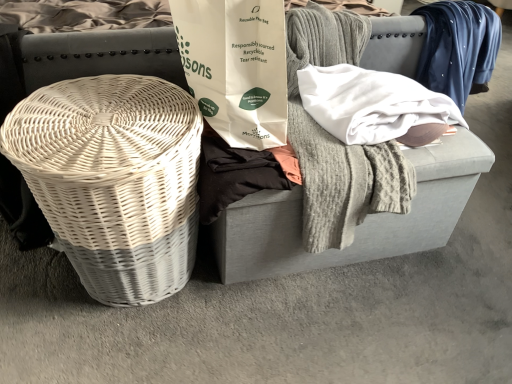
What do you see at coordinates (239, 173) in the screenshot? I see `black cotton shirt at center` at bounding box center [239, 173].

The width and height of the screenshot is (512, 384). What do you see at coordinates (357, 226) in the screenshot? I see `gray fabric footrest at center` at bounding box center [357, 226].

Identify the location of white wicker basket at left. (359, 227).

This screenshot has height=384, width=512. What do you see at coordinates (236, 67) in the screenshot?
I see `white paper bag at center` at bounding box center [236, 67].

Where is `black cotton shirt at center`? black cotton shirt at center is located at coordinates (239, 173).

From a real-world perspective, is white paper bag at center physically located above or below white wicker basket at left?

white paper bag at center is situated higher than white wicker basket at left in the real world.

From the image's perspective, which is above, white paper bag at center or white wicker basket at left?

white wicker basket at left.

The image size is (512, 384). I want to click on furniture that appears on the left of white paper bag at center, so click(x=359, y=227).

Considering the sizes of objects white paper bag at center and white wicker basket at left in the image provided, who is bigger, white paper bag at center or white wicker basket at left?

Bigger between the two is white wicker basket at left.

Is gray fabric footrest at center next to white paper bag at center and touching it?

There is a gap between gray fabric footrest at center and white paper bag at center.

Is white paper bag at center at the back of gray fabric footrest at center?

gray fabric footrest at center does not have its back to white paper bag at center.

Is point (252, 270) positioned before point (210, 7)?

No, it is behind (210, 7).

Which is in front, gray fabric footrest at center or white paper bag at center?

Positioned in front is white paper bag at center.

Considering the relative positions of gray fabric footrest at center and black cotton shirt at center in the image provided, is gray fabric footrest at center to the left of black cotton shirt at center from the viewer's perspective?

In fact, gray fabric footrest at center is to the right of black cotton shirt at center.

Considering the sizes of objects gray fabric footrest at center and black cotton shirt at center in the image provided, who is thinner, gray fabric footrest at center or black cotton shirt at center?

black cotton shirt at center.

Who is bigger, gray fabric footrest at center or black cotton shirt at center?

gray fabric footrest at center.

From a real-world perspective, is gray fabric footrest at center positioned above or below black cotton shirt at center?

gray fabric footrest at center is situated lower than black cotton shirt at center in the real world.

This screenshot has width=512, height=384. Identify the location of furniture above the gray fabric footrest at center (from a real-world perspective). (359, 227).

Is white wicker basket at left not inside gray fabric footrest at center?

That's correct, white wicker basket at left is outside of gray fabric footrest at center.

Considering the sizes of objects white wicker basket at left and gray fabric footrest at center in the image provided, who is taller, white wicker basket at left or gray fabric footrest at center?

→ white wicker basket at left is taller.

Is point (409, 220) behind point (225, 213)?

Yes, point (409, 220) is farther from viewer.

Considering the relative sizes of white wicker basket at left and black cotton shirt at center in the image provided, is white wicker basket at left wider than black cotton shirt at center?

Correct, the width of white wicker basket at left exceeds that of black cotton shirt at center.

How much distance is there between white wicker basket at left and black cotton shirt at center?

white wicker basket at left and black cotton shirt at center are 8.42 inches apart.

Considering the points (142, 112) and (293, 174), which point is behind, point (142, 112) or point (293, 174)?

The point (293, 174) is more distant.

Find the location of a particular element. clothing on the right of the white wicker basket at left is located at coordinates (239, 173).

Can you confirm if white wicker basket at left is taller than white wicker basket at left?

No.

Is white wicker basket at left positioned with its back to white wicker basket at left?

Yes.

Is white wicker basket at left in contact with white wicker basket at left?

No, white wicker basket at left is not in contact with white wicker basket at left.

Is white wicker basket at left surrounding white wicker basket at left?

No, white wicker basket at left is located outside of white wicker basket at left.

The image size is (512, 384). Find the location of `basket in front of the white paper bag at center`. basket in front of the white paper bag at center is located at coordinates (114, 180).

Is white paper bag at center positioned with its back to white wicker basket at left?

No, white paper bag at center is not facing the opposite direction of white wicker basket at left.

Looking at their sizes, would you say white paper bag at center is wider or thinner than white wicker basket at left?

white paper bag at center is thinner than white wicker basket at left.

Based on the photo, can you confirm if white paper bag at center is positioned to the right of white wicker basket at left?

Correct, you'll find white paper bag at center to the right of white wicker basket at left.

Where is `furniture that is behind the white paper bag at center`? The width and height of the screenshot is (512, 384). furniture that is behind the white paper bag at center is located at coordinates click(359, 227).

Locate an element on the screen. The height and width of the screenshot is (384, 512). shopping bag located above the gray fabric footrest at center (from the image's perspective) is located at coordinates tap(236, 67).

From the image, which object appears to be farther from white paper bag at center, white wicker basket at left or gray fabric footrest at center?

gray fabric footrest at center.

From the image, which object appears to be farther from white paper bag at center, white wicker basket at left or gray fabric footrest at center?

Based on the image, gray fabric footrest at center appears to be further to white paper bag at center.

From the image, which object appears to be nearer to black cotton shirt at center, white wicker basket at left or white paper bag at center?

white paper bag at center lies closer to black cotton shirt at center than the other object.

Based on their spatial positions, is white wicker basket at left or white wicker basket at left further from gray fabric footrest at center?

Based on the image, white wicker basket at left appears to be further to gray fabric footrest at center.

Which object lies further to the anchor point black cotton shirt at center, gray fabric footrest at center or white paper bag at center?

Among the two, gray fabric footrest at center is located further to black cotton shirt at center.

Based on their spatial positions, is black cotton shirt at center or white wicker basket at left further from white paper bag at center?

Based on the image, white wicker basket at left appears to be further to white paper bag at center.

Considering their positions, is white wicker basket at left positioned closer to gray fabric footrest at center than white paper bag at center?

white paper bag at center.

Looking at the image, which one is located further to gray fabric footrest at center, white wicker basket at left or black cotton shirt at center?

Based on the image, white wicker basket at left appears to be further to gray fabric footrest at center.

You are a GUI agent. You are given a task and a screenshot of the screen. Output one action in this format:
    pyautogui.click(x=<x>, y=<y>)
    Task: Click on the shopping bag between white wicker basket at left and gray fabric footrest at center
    This screenshot has width=512, height=384.
    Given the screenshot: What is the action you would take?
    pyautogui.click(x=236, y=67)

Identify the location of clothing between white wicker basket at left and white wicker basket at left from top to bottom. This screenshot has width=512, height=384. (239, 173).

This screenshot has width=512, height=384. In order to click on shopping bag between white wicker basket at left and black cotton shirt at center vertically in this screenshot , I will do `click(236, 67)`.

Find the location of `shopping bag between white wicker basket at left and white wicker basket at left in the vertical direction`. shopping bag between white wicker basket at left and white wicker basket at left in the vertical direction is located at coordinates pyautogui.click(x=236, y=67).